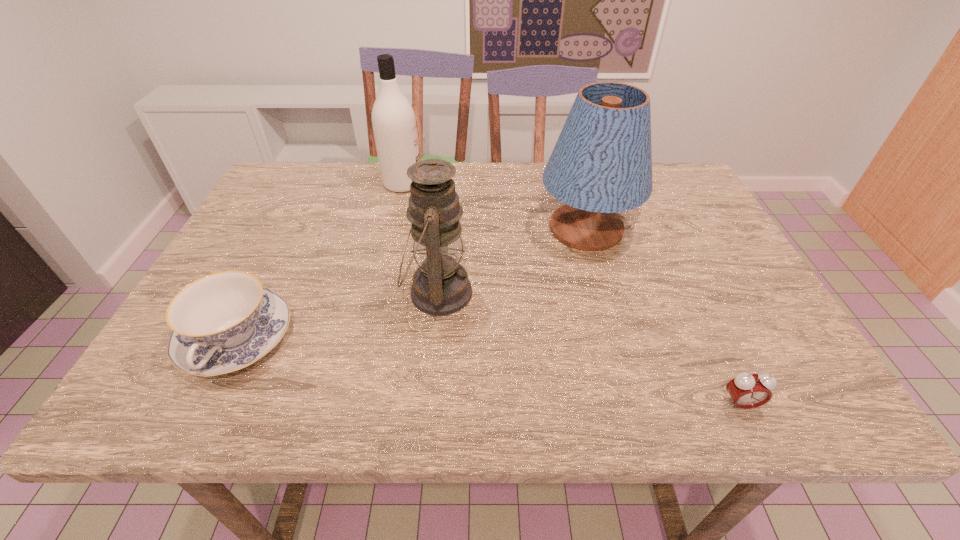
What are the coordinates of `free space between the chinaware and the oil lamp` in the screenshot? It's located at (337, 316).

Locate an element on the screen. vacant space that is in between the rightmost object and the leftmost object is located at coordinates (488, 372).

Point out which object is positioned as the second nearest to the lampshade. Please provide its 2D coordinates. Your answer should be formatted as a tuple, i.e. [(x, y)], where the tuple contains the x and y coordinates of a point satisfying the conditions above.

[(394, 125)]

At what (x,y) coordinates should I click in order to perform the action: click on object that ranks as the fourth closest to the oil lamp. Please return your answer as a coordinate pair (x, y). Image resolution: width=960 pixels, height=540 pixels. Looking at the image, I should click on (747, 391).

Find the location of a particular element. Image resolution: width=960 pixels, height=540 pixels. free region that satisfies the following two spatial constraints: 1. on the back side of the oil lamp; 2. on the front-facing side of the shampoo is located at coordinates (448, 184).

At what (x,y) coordinates should I click in order to perform the action: click on blank area in the image that satisfies the following two spatial constraints: 1. on the front-facing side of the shampoo; 2. on the right side of the oil lamp. Please return your answer as a coordinate pair (x, y). Looking at the image, I should click on (377, 293).

Find the location of a particular element. free location that satisfies the following two spatial constraints: 1. on the back side of the oil lamp; 2. on the front-facing side of the shampoo is located at coordinates (448, 184).

Where is `vacant space that satisfies the following two spatial constraints: 1. on the front-facing side of the oil lamp; 2. on the left side of the farthest object`? The image size is (960, 540). vacant space that satisfies the following two spatial constraints: 1. on the front-facing side of the oil lamp; 2. on the left side of the farthest object is located at coordinates (377, 293).

Find the location of `free location that satisfies the following two spatial constraints: 1. on the back side of the oil lamp; 2. on the right side of the fourth object from left to right`. free location that satisfies the following two spatial constraints: 1. on the back side of the oil lamp; 2. on the right side of the fourth object from left to right is located at coordinates (444, 228).

Locate an element on the screen. vacant space that satisfies the following two spatial constraints: 1. on the back side of the oil lamp; 2. on the front-facing side of the shampoo is located at coordinates (448, 184).